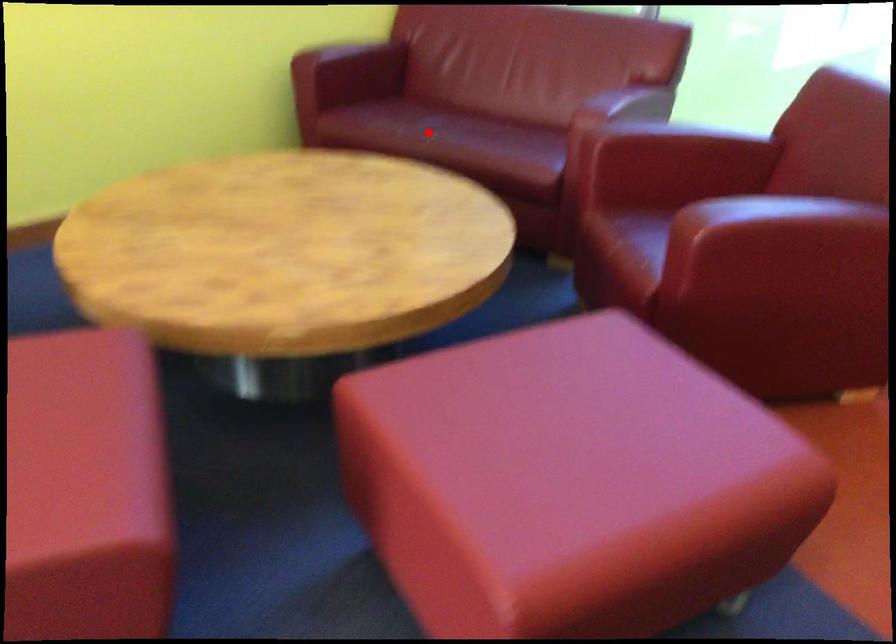
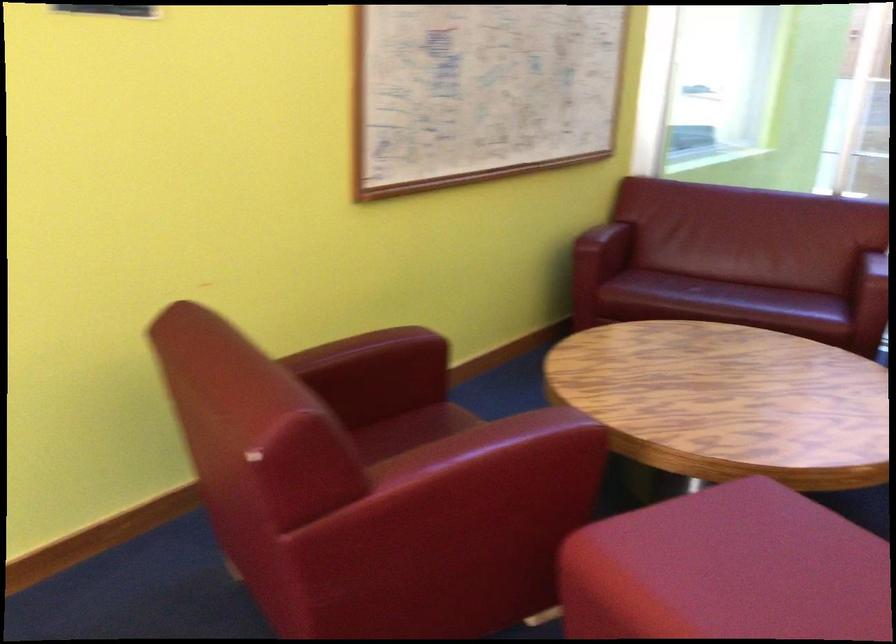
Question: I am providing you with two images of the same scene from different viewpoints. A red point is shown in image1. For the corresponding object point in image2, is it positioned nearer or farther from the camera?

Choices:
 (A) Nearer
 (B) Farther

Answer: (B)